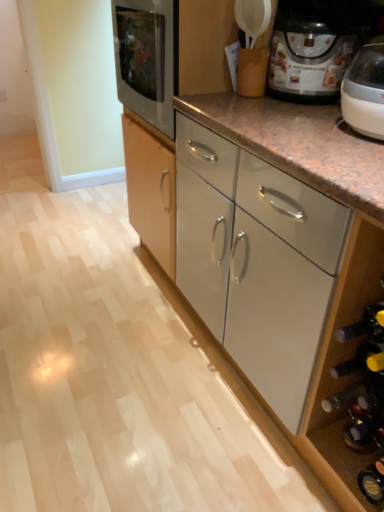
Question: Could matte black coffee maker at upper right be considered to be inside matte black wine bottle at lower right?

Choices:
 (A) yes
 (B) no

Answer: (B)

Question: Considering the relative sizes of matte black wine bottle at lower right and matte black coffee maker at upper right in the image provided, is matte black wine bottle at lower right bigger than matte black coffee maker at upper right?

Choices:
 (A) no
 (B) yes

Answer: (A)

Question: Can you confirm if matte black wine bottle at lower right is positioned to the right of matte black coffee maker at upper right?

Choices:
 (A) no
 (B) yes

Answer: (A)

Question: Considering the relative sizes of matte black wine bottle at lower right and matte black coffee maker at upper right in the image provided, is matte black wine bottle at lower right smaller than matte black coffee maker at upper right?

Choices:
 (A) yes
 (B) no

Answer: (A)

Question: Would you say matte black wine bottle at lower right is a long distance from matte black coffee maker at upper right?

Choices:
 (A) yes
 (B) no

Answer: (B)

Question: Choose the correct answer: Is matte black coffee maker at upper right inside white glossy cabinet at center or outside it?

Choices:
 (A) inside
 (B) outside

Answer: (B)

Question: From a real-world perspective, relative to white glossy cabinet at center, is matte black coffee maker at upper right vertically above or below?

Choices:
 (A) above
 (B) below

Answer: (A)

Question: In the image, is matte black coffee maker at upper right positioned in front of or behind white glossy cabinet at center?

Choices:
 (A) behind
 (B) front

Answer: (A)

Question: Is matte black coffee maker at upper right bigger or smaller than white glossy cabinet at center?

Choices:
 (A) small
 (B) big

Answer: (A)

Question: Looking at their shapes, would you say white glossy cabinet at center is wider or thinner than matte black coffee maker at upper right?

Choices:
 (A) thin
 (B) wide

Answer: (B)

Question: Visually, is white glossy cabinet at center positioned to the left or to the right of matte black coffee maker at upper right?

Choices:
 (A) left
 (B) right

Answer: (A)

Question: Is point (254, 112) positioned closer to the camera than point (354, 41)?

Choices:
 (A) closer
 (B) farther

Answer: (A)

Question: From the image's perspective, is white glossy cabinet at center above or below matte black coffee maker at upper right?

Choices:
 (A) above
 (B) below

Answer: (B)

Question: Is matte black wine bottle at lower right taller or shorter than matte black coffee maker at upper right?

Choices:
 (A) short
 (B) tall

Answer: (A)

Question: Is matte black wine bottle at lower right inside or outside of matte black coffee maker at upper right?

Choices:
 (A) outside
 (B) inside

Answer: (A)